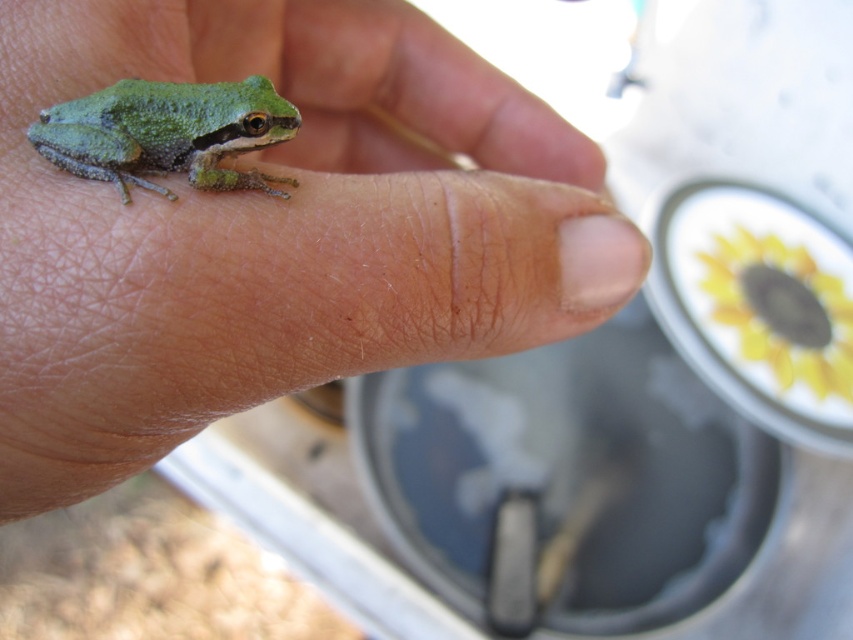
Question: Is the position of green matte skin at center less distant than that of green matte frog at center?

Choices:
 (A) no
 (B) yes

Answer: (B)

Question: Can you confirm if green matte skin at center is bigger than green matte frog at center?

Choices:
 (A) yes
 (B) no

Answer: (A)

Question: Which object is farther from the camera taking this photo?

Choices:
 (A) green matte skin at center
 (B) green matte frog at center

Answer: (B)

Question: Is green matte skin at center thinner than green matte frog at center?

Choices:
 (A) yes
 (B) no

Answer: (B)